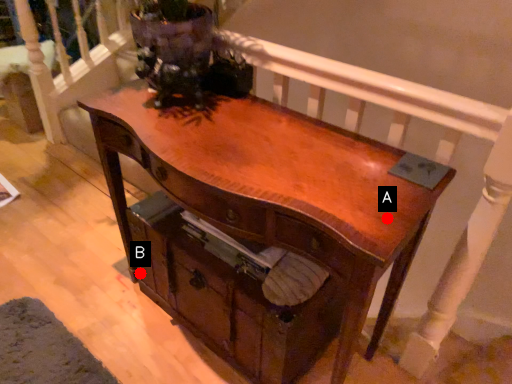
Question: Two points are circled on the image, labeled by A and B beside each circle. Which point is further to the camera?

Choices:
 (A) A is further
 (B) B is further

Answer: (B)